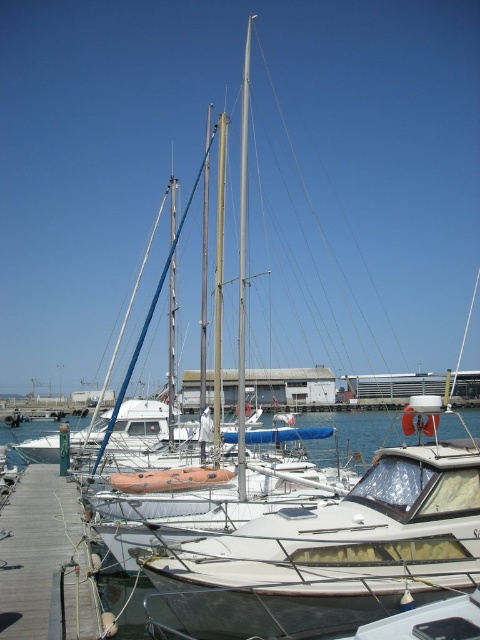
Can you confirm if wooden dock at lower left is taller than white metallic mast at center?

In fact, wooden dock at lower left may be shorter than white metallic mast at center.

Who is more forward, (47, 548) or (241, 474)?

Point (241, 474)

Which is behind, point (40, 531) or point (243, 442)?

Positioned behind is point (40, 531).

I want to click on wooden dock at lower left, so click(46, 561).

Who is positioned more to the right, white glossy sailboat at center or white metallic mast at center?

white glossy sailboat at center is more to the right.

Does white glossy sailboat at center lie behind white metallic mast at center?

That is False.

Is point (214, 554) behind point (244, 70)?

No, it is not.

You are a GUI agent. You are given a task and a screenshot of the screen. Output one action in this format:
    pyautogui.click(x=<x>, y=<y>)
    Task: Click on the white glossy sailboat at center
    The width and height of the screenshot is (480, 640).
    Given the screenshot: What is the action you would take?
    pyautogui.click(x=335, y=552)

Who is positioned more to the left, white glossy sailboat at center or wooden dock at lower left?

wooden dock at lower left

Is point (380, 476) farther from camera compared to point (36, 616)?

Yes.

This screenshot has height=640, width=480. What are the coordinates of `white glossy sailboat at center` in the screenshot? It's located at (335, 552).